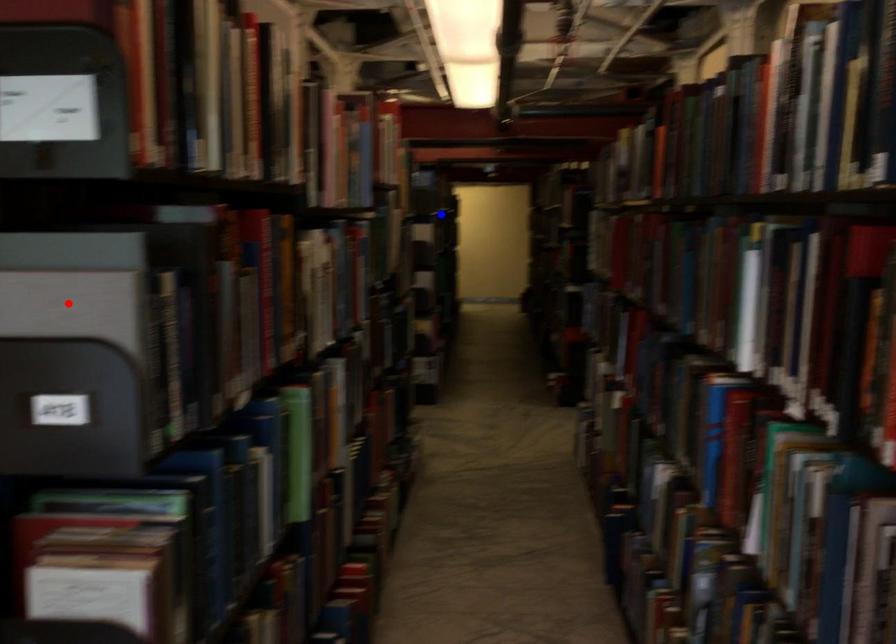
Question: Which of the two points in the image is closer to the camera?

Choices:
 (A) Blue point is closer.
 (B) Red point is closer.

Answer: (B)